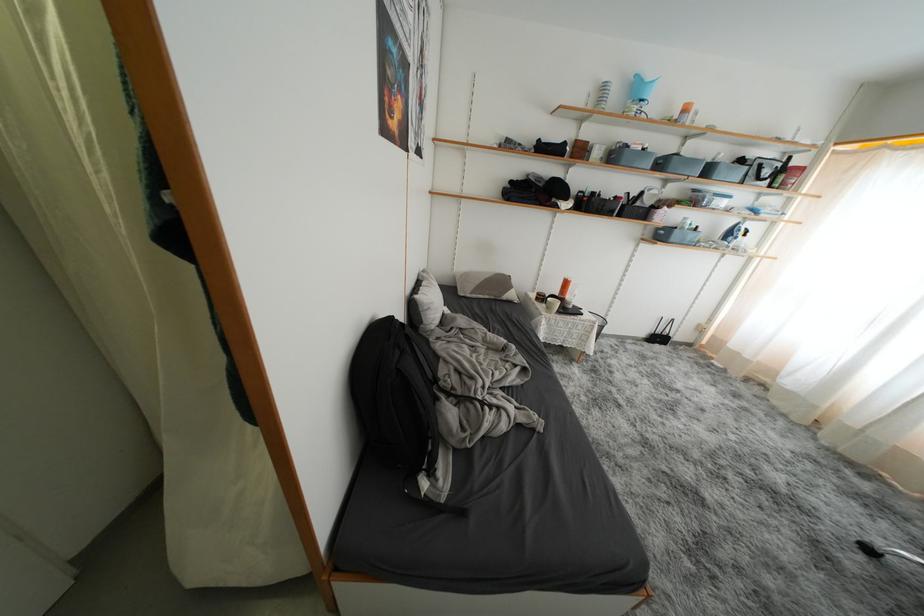
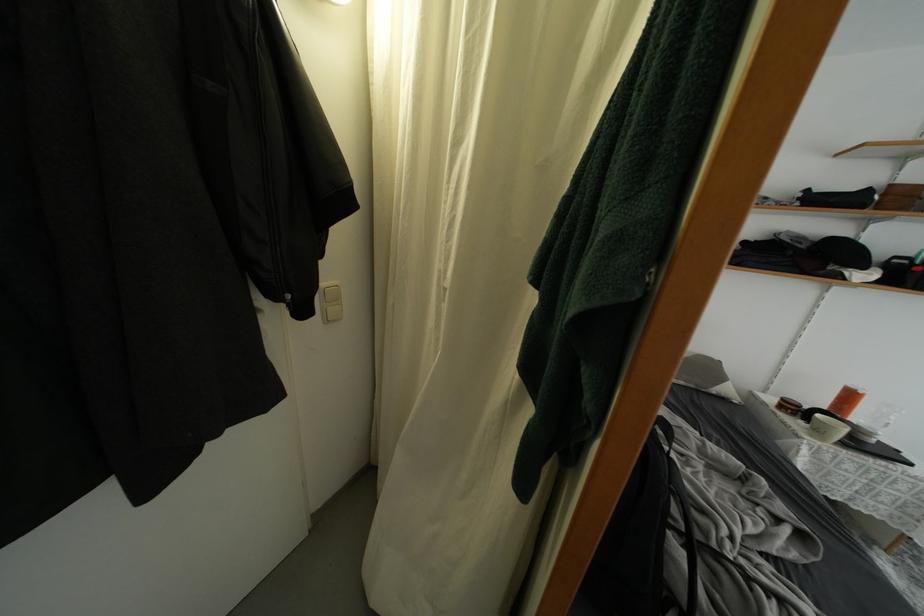
The point at (x=554, y=313) is marked in the first image. Where is the corresponding point in the second image?

(823, 437)